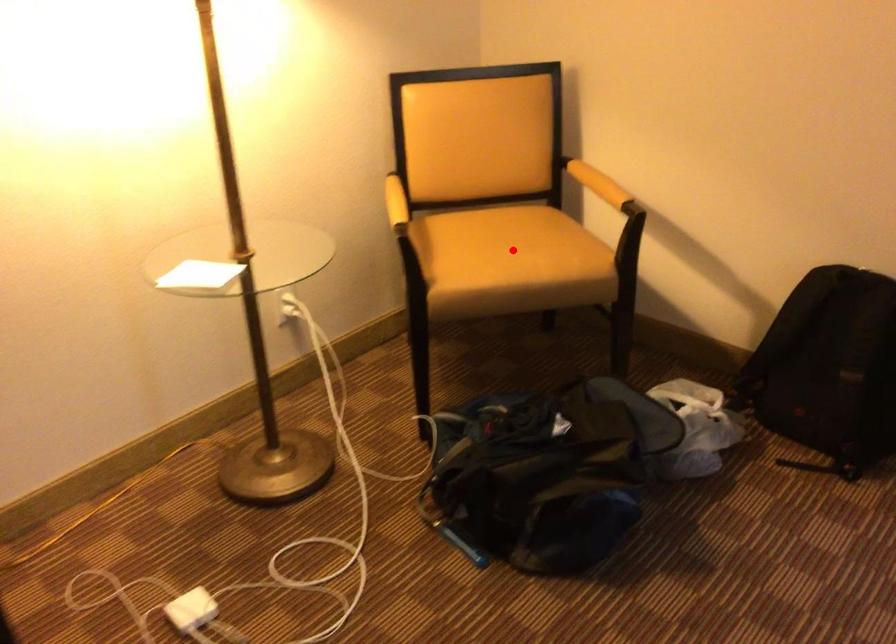
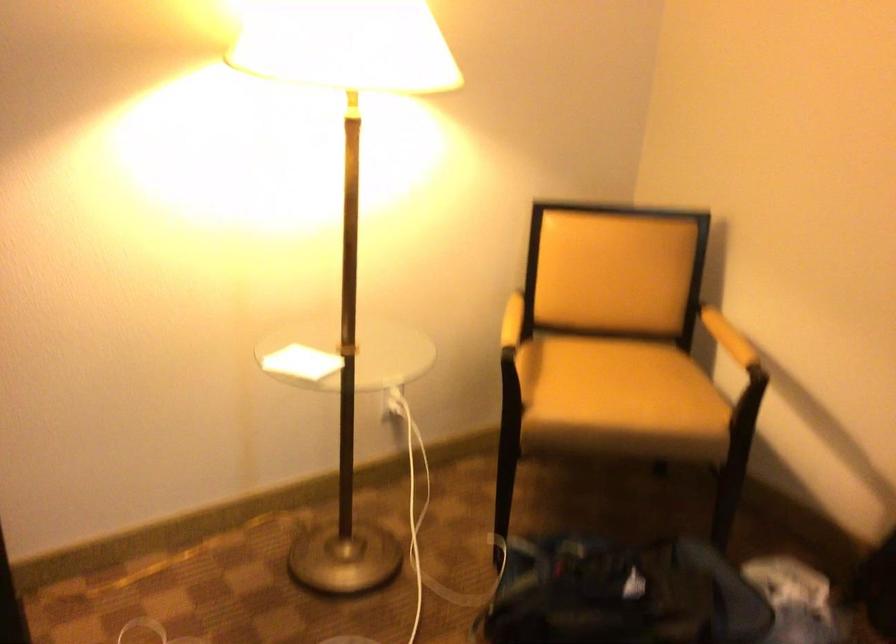
In the second image, find the point that corresponds to the highlighted location in the first image.

(618, 388)